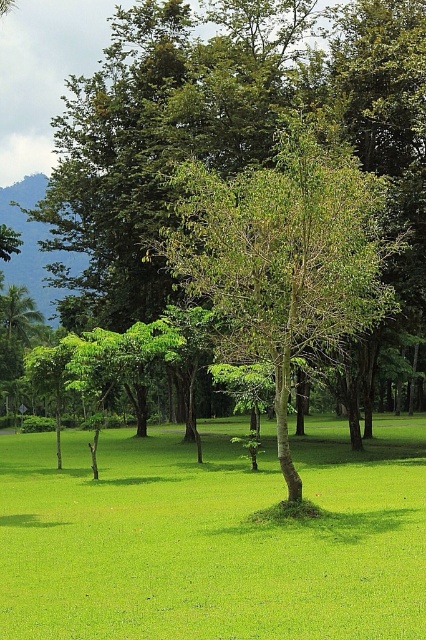
Which is above, green grass at center or green leafy tree at center?

green leafy tree at center is above.

Is point (97, 636) behind point (287, 220)?

That is False.

Where is `green grass at center`? The image size is (426, 640). green grass at center is located at coordinates (213, 538).